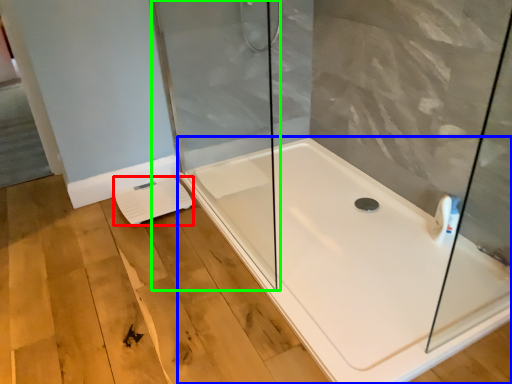
Question: Which object is the closest to the lift (highlighted by a red box)? Choose among these: bathtub (highlighted by a blue box) or shower door (highlighted by a green box).

Choices:
 (A) bathtub
 (B) shower door

Answer: (B)